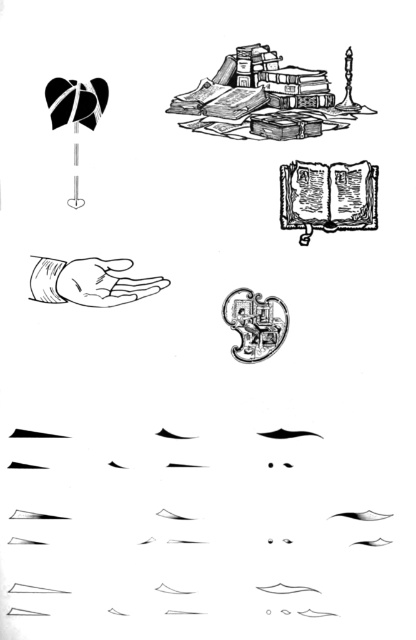
You are a GUI agent. You are given a task and a screenshot of the screen. Output one action in this format:
    pyautogui.click(x=<x>, y=<y>)
    Task: Click on the stacked books at upper center
    The height and width of the screenshot is (640, 416).
    Given the screenshot: What is the action you would take?
    pyautogui.click(x=267, y=99)

Is stacked books at upper center thinner than smooth skin hand at center?

In fact, stacked books at upper center might be wider than smooth skin hand at center.

Find the location of `stacked books at upper center`. stacked books at upper center is located at coordinates (267, 99).

Is open book at upper right in front of shiny metallic key at center?

Yes, open book at upper right is closer to the viewer.

Identify the location of open book at upper right. Image resolution: width=416 pixels, height=640 pixels. click(327, 196).

Which is above, stacked books at upper center or open book at upper right?

Positioned higher is stacked books at upper center.

Consider the image. Is stacked books at upper center wider than open book at upper right?

Yes, stacked books at upper center is wider than open book at upper right.

Find the location of a particular element. The width and height of the screenshot is (416, 640). stacked books at upper center is located at coordinates (267, 99).